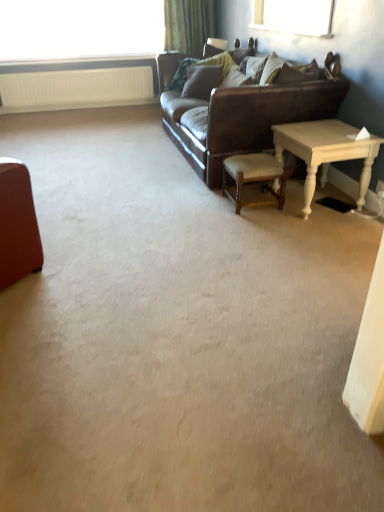
Find the location of a particular element. The image size is (384, 512). textured beige pillow at upper right is located at coordinates (253, 67).

Identify the location of leather couch at center. pos(244,119).

At what (x,y) coordinates should I click in order to perform the action: click on transparent glass window at upper left. Please return your answer as a coordinate pair (x, y). This screenshot has height=512, width=384. Looking at the image, I should click on (80, 29).

Measure the distance between white textured radiator at upper left and camera.

The depth of white textured radiator at upper left is 5.18 meters.

Locate an element on the screen. The width and height of the screenshot is (384, 512). textured beige pillow at upper right is located at coordinates (253, 67).

Is green fabric curtain at upper center inside white painted wood table at right?

Definitely not — green fabric curtain at upper center is not inside white painted wood table at right.

Between white painted wood table at right and green fabric curtain at upper center, which one has larger size?

white painted wood table at right.

Is white painted wood table at right touching green fabric curtain at upper center?

No, white painted wood table at right is not with green fabric curtain at upper center.

Is green fabric curtain at upper center bigger or smaller than white painted wood table at right?

Considering their sizes, green fabric curtain at upper center takes up less space than white painted wood table at right.

From the image's perspective, relative to white painted wood table at right, is green fabric curtain at upper center above or below?

Based on their image positions, green fabric curtain at upper center is located above white painted wood table at right.

Which object is more forward, green fabric curtain at upper center or white painted wood table at right?

Positioned in front is white painted wood table at right.

Is green fabric curtain at upper center far from white painted wood table at right?

That's right, there is a large distance between green fabric curtain at upper center and white painted wood table at right.

Is white textured radiator at upper left positioned with its back to white painted wood table at right?

No, white painted wood table at right is not at the back of white textured radiator at upper left.

Considering the positions of point (81, 91) and point (362, 183), is point (81, 91) closer or farther from the camera than point (362, 183)?

Point (81, 91).

Based on the photo, considering the relative positions of white textured radiator at upper left and white painted wood table at right in the image provided, is white textured radiator at upper left to the right of white painted wood table at right from the viewer's perspective?

Incorrect, white textured radiator at upper left is not on the right side of white painted wood table at right.

Can you confirm if white textured radiator at upper left is wider than white painted wood table at right?

No, white textured radiator at upper left is not wider than white painted wood table at right.

Considering the relative positions of leather couch at center and green fabric curtain at upper center in the image provided, is leather couch at center to the left of green fabric curtain at upper center from the viewer's perspective?

No.

Can you confirm if leather couch at center is shorter than green fabric curtain at upper center?

Incorrect, the height of leather couch at center does not fall short of that of green fabric curtain at upper center.

Considering the sizes of objects leather couch at center and green fabric curtain at upper center in the image provided, who is thinner, leather couch at center or green fabric curtain at upper center?

green fabric curtain at upper center.

How many degrees apart are the facing directions of leather couch at center and green fabric curtain at upper center?

The angle between the facing direction of leather couch at center and the facing direction of green fabric curtain at upper center is 90 degrees.

Which point is more distant from viewer, (300, 141) or (60, 41)?

Positioned behind is point (60, 41).

Considering the relative sizes of white painted wood table at right and transparent glass window at upper left in the image provided, is white painted wood table at right shorter than transparent glass window at upper left?

Yes.

From the image's perspective, which is below, white painted wood table at right or transparent glass window at upper left?

white painted wood table at right, from the image's perspective.

Considering the sizes of objects white painted wood table at right and transparent glass window at upper left in the image provided, who is bigger, white painted wood table at right or transparent glass window at upper left?

transparent glass window at upper left is bigger.

Which is in front, point (41, 91) or point (331, 101)?

The point (331, 101) is closer to the camera.

From their relative heights in the image, would you say white textured radiator at upper left is taller or shorter than leather couch at center?

In the image, white textured radiator at upper left appears to be shorter than leather couch at center.

Relative to leather couch at center, is white textured radiator at upper left in front or behind?

white textured radiator at upper left is behind leather couch at center.

From a real-world perspective, between leather couch at center and textured beige pillow at upper right, who is vertically lower?

In real-world perspective, leather couch at center is lower.

Which is more to the left, leather couch at center or textured beige pillow at upper right?

Positioned to the left is leather couch at center.

What's the angular difference between leather couch at center and textured beige pillow at upper right's facing directions?

0.00151 degrees.

Is leather couch at center taller than textured beige pillow at upper right?

Indeed, leather couch at center has a greater height compared to textured beige pillow at upper right.

Identify the location of table in front of the green fabric curtain at upper center. This screenshot has width=384, height=512. (326, 152).

This screenshot has height=512, width=384. In order to click on table that is below the green fabric curtain at upper center (from the image's perspective) in this screenshot , I will do `click(326, 152)`.

Based on the photo, estimate the real-world distances between objects in this image. Which object is further from white textured radiator at upper left, wooden chair at center or textured beige pillow at upper right?

wooden chair at center is positioned further to the anchor white textured radiator at upper left.

Estimate the real-world distances between objects in this image. Which object is closer to textured beige pillow at upper right, white textured radiator at upper left or wooden chair at center?

The object closer to textured beige pillow at upper right is wooden chair at center.

From the picture: Which object lies further to the anchor point textured beige pillow at upper right, white painted wood table at right or transparent glass window at upper left?

transparent glass window at upper left is further to textured beige pillow at upper right.

Which object lies nearer to the anchor point transparent glass window at upper left, textured beige pillow at upper right or white textured radiator at upper left?

white textured radiator at upper left.

Estimate the real-world distances between objects in this image. Which object is closer to wooden chair at center, textured beige pillow at upper right or leather couch at center?

The object closer to wooden chair at center is leather couch at center.

Based on their spatial positions, is white textured radiator at upper left or leather couch at center further from transparent glass window at upper left?

Among the two, leather couch at center is located further to transparent glass window at upper left.

Looking at the image, which one is located further to white textured radiator at upper left, white painted wood table at right or wooden chair at center?

white painted wood table at right lies further to white textured radiator at upper left than the other object.

Looking at the image, which one is located further to green fabric curtain at upper center, textured beige pillow at upper right or leather couch at center?

Among the two, leather couch at center is located further to green fabric curtain at upper center.

Find the location of a particular element. The height and width of the screenshot is (512, 384). pillow between green fabric curtain at upper center and wooden chair at center from top to bottom is located at coordinates (253, 67).

This screenshot has width=384, height=512. Find the location of `window between white painted wood table at right and green fabric curtain at upper center in the front-back direction`. window between white painted wood table at right and green fabric curtain at upper center in the front-back direction is located at coordinates (80, 29).

Identify the location of chair between leather couch at center and transparent glass window at upper left along the z-axis. This screenshot has width=384, height=512. (254, 175).

Locate an element on the screen. This screenshot has height=512, width=384. chair between leather couch at center and white textured radiator at upper left from front to back is located at coordinates (254, 175).